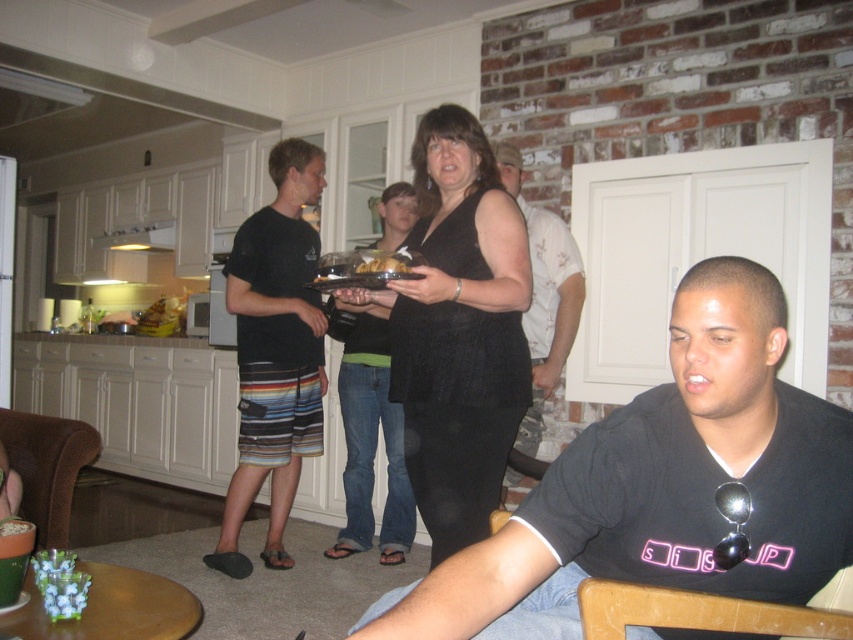
You are a photographer trying to capture the perfect shot of the black matte tank top at center. Based on its position in the image, what coordinates should you aim your camera at to center the subject?

The black matte tank top at center is located at coordinates point (370, 442), so aiming the camera at those coordinates will center the subject.

You are a guest at the party and notice two items at the center of the table. One is the black matte tank top at center and the other is the matte black shirt at center. Which one is positioned lower on the table?

The black matte tank top at center is below the matte black shirt at center, so it is positioned lower on the table.

You are a guest at the party and want to place a small decorative item on the table. The black matte vest at center and the brown crumbly cake at center are already there. Which object leaves more space for your item?

The black matte vest at center is bigger than the brown crumbly cake at center, so placing the item near the brown crumbly cake at center would leave more space.